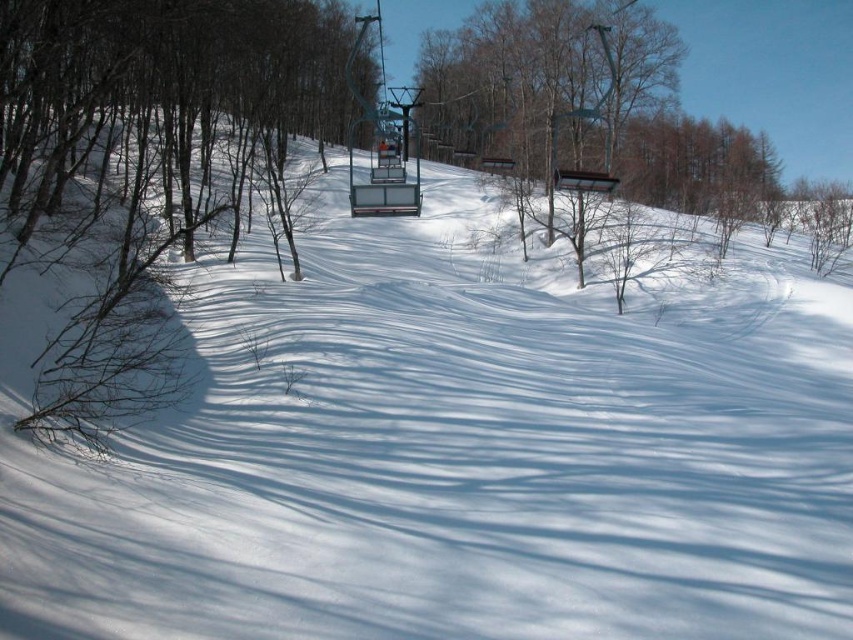
Is the position of brown bark tree at left less distant than that of metallic blue ski lift at center?

Yes, it is in front of metallic blue ski lift at center.

Who is taller, brown bark tree at left or metallic blue ski lift at center?

Standing taller between the two is brown bark tree at left.

Is point (241, 92) farther from viewer compared to point (368, 115)?

Yes, it is behind point (368, 115).

Identify the location of brown bark tree at left. (148, 172).